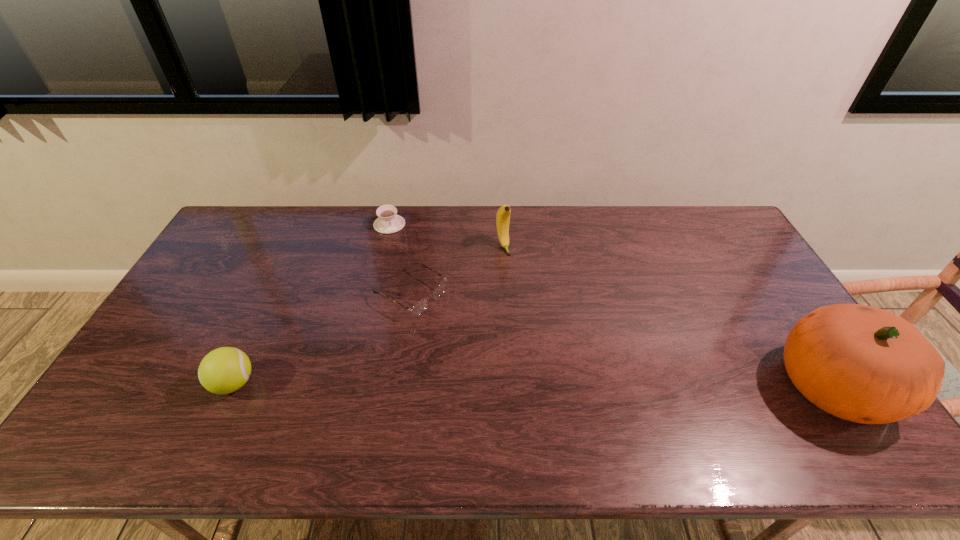
What are the coordinates of `free spot on the desktop that is between the leftmost object and the tallest object and is positioned on the front-facing side of the third farthest object` in the screenshot? It's located at (563, 384).

This screenshot has width=960, height=540. What are the coordinates of `vacant space on the desktop that is between the tennis ball and the rightmost object and is positioned from the stem of the second object from right to left` in the screenshot? It's located at (573, 384).

The width and height of the screenshot is (960, 540). What are the coordinates of `free space on the desktop that is between the third shortest object and the tallest object and is positioned on the handle side of the farthest object` in the screenshot? It's located at (445, 384).